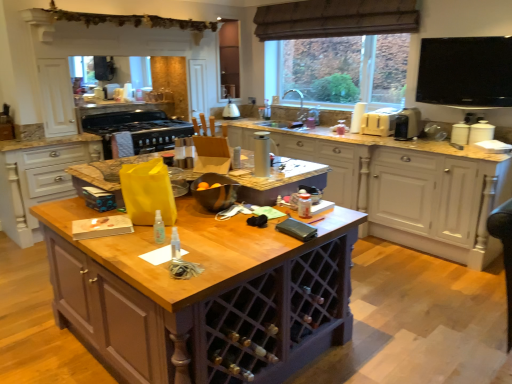
The width and height of the screenshot is (512, 384). Identify the location of vacant space in front of silver metallic thermos at center, the fourth appliance when ordered from right to left. (259, 180).